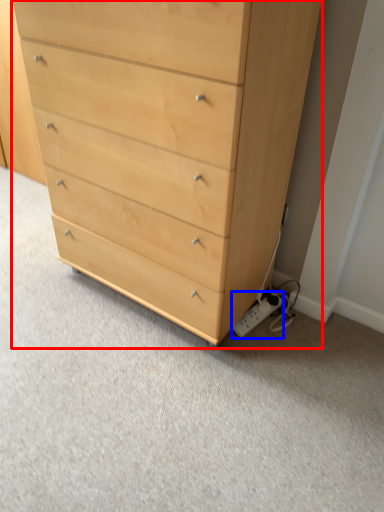
Question: Which object appears closest to the camera in this image, chest of drawers (highlighted by a red box) or electric outlet (highlighted by a blue box)?

Choices:
 (A) chest of drawers
 (B) electric outlet

Answer: (A)